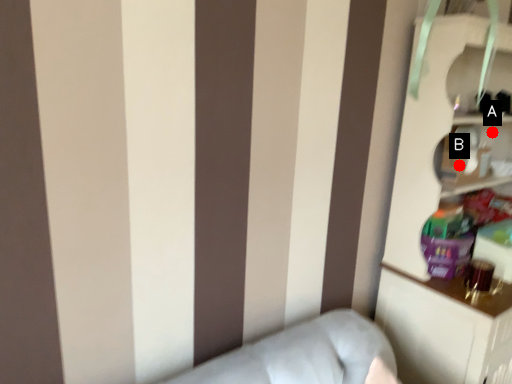
Question: Two points are circled on the image, labeled by A and B beside each circle. Which of the following is the farthest from the observer?

Choices:
 (A) A is further
 (B) B is further

Answer: (A)